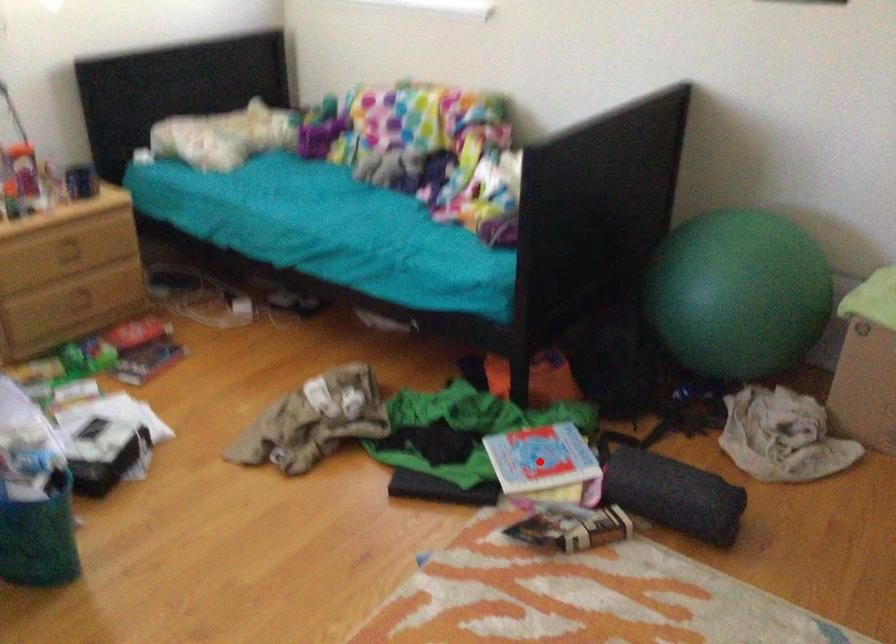
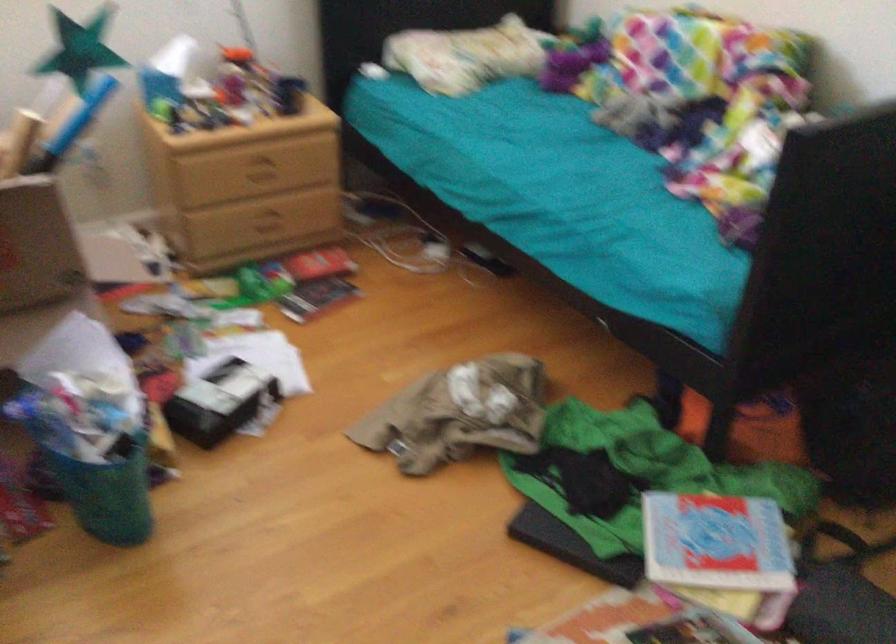
In the second image, find the point that corresponds to the highlighted location in the first image.

(716, 542)